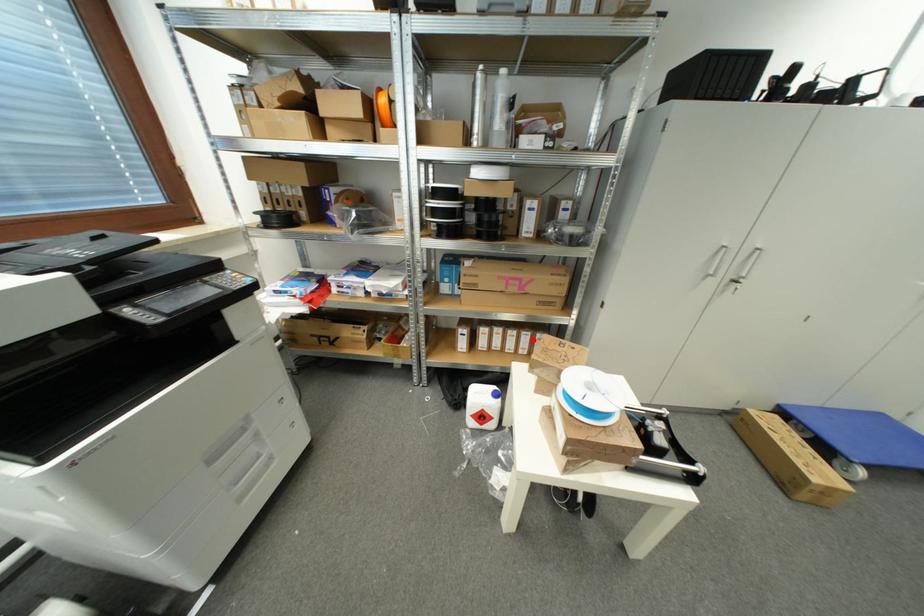
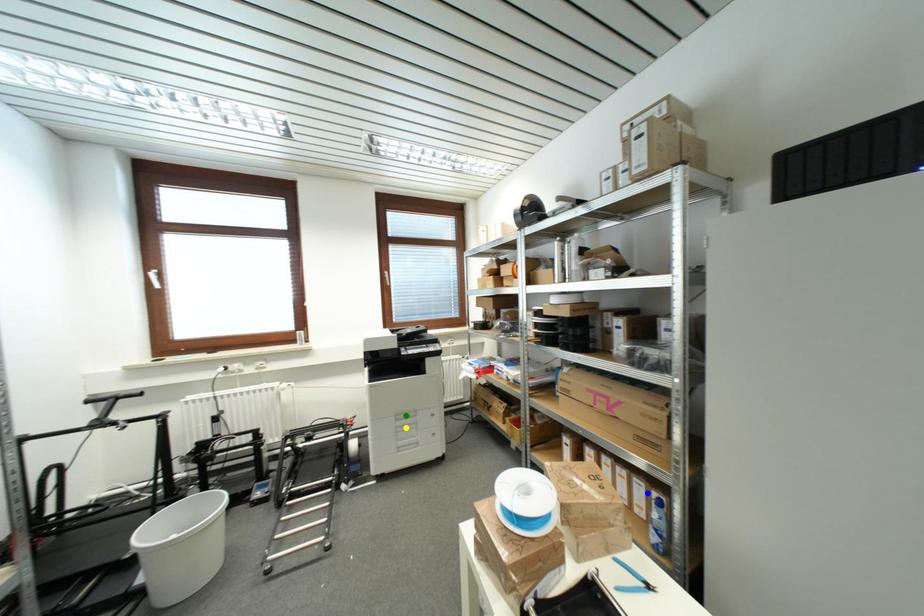
Question: I am providing you with two images of the same scene from different viewpoints. A red point is marked on the first image. You are given multiple points on the second image. Can you choose the point in image 2 that corresponds to the point in image 1?

Choices:
 (A) yellow point
 (B) green point
 (C) blue point

Answer: (C)